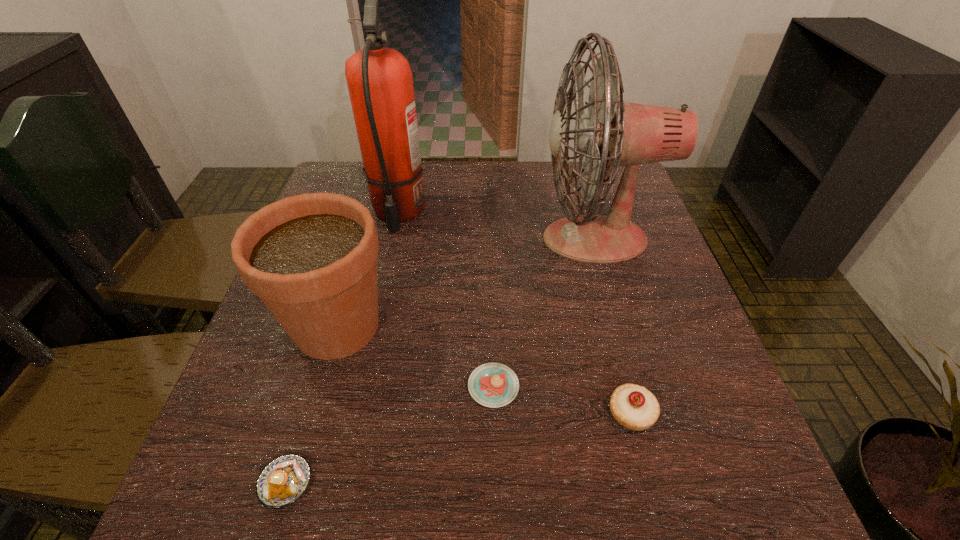
The height and width of the screenshot is (540, 960). Identify the location of fire extinguisher. click(380, 83).

Where is `fan`? fan is located at coordinates (614, 133).

This screenshot has height=540, width=960. I want to click on flowerpot, so click(311, 258).

Identify the location of the tallest pastry. This screenshot has height=540, width=960. (634, 407).

In order to click on the third shortest object in this screenshot , I will do `click(634, 407)`.

You are a GUI agent. You are given a task and a screenshot of the screen. Output one action in this format:
    pyautogui.click(x=<x>, y=<y>)
    Task: Click on the fourth object from left to right
    This screenshot has height=540, width=960.
    Given the screenshot: What is the action you would take?
    (x=493, y=385)

The height and width of the screenshot is (540, 960). I want to click on the leftmost pastry, so click(282, 481).

Where is `the nearest object`? This screenshot has height=540, width=960. the nearest object is located at coordinates (282, 481).

The width and height of the screenshot is (960, 540). I want to click on free location located on the nozzle of the fire extinguisher, so click(x=380, y=291).

At what (x,y) coordinates should I click in order to perform the action: click on free space located 0.120m in front of the fan to direct airflow. Please return your answer as a coordinate pair (x, y). The image size is (960, 540). Looking at the image, I should click on click(x=490, y=239).